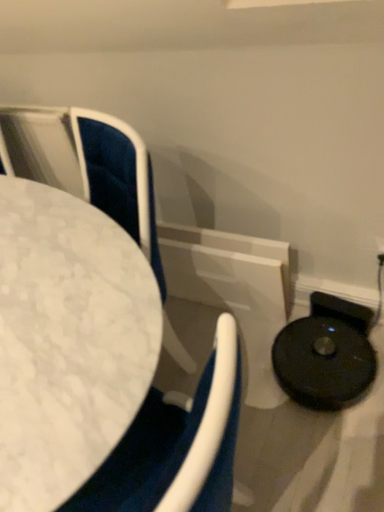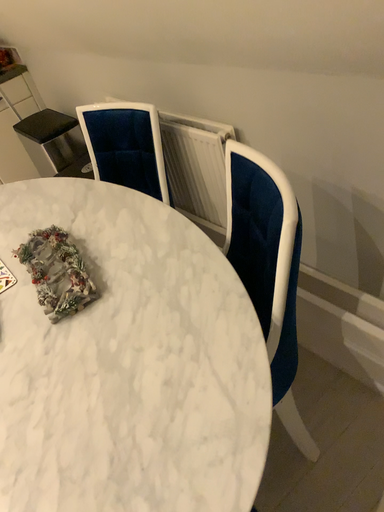
Question: Which way did the camera rotate in the video?

Choices:
 (A) rotated left
 (B) rotated right

Answer: (A)